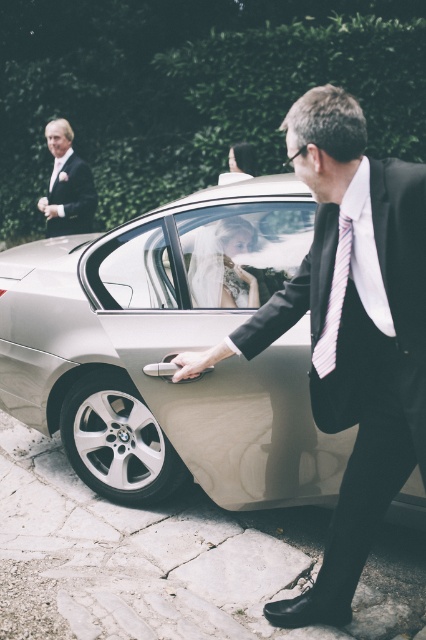
What is the object located at the point with coordinates (170,349) in the image?

The point at (170,349) marks the silver metallic car at center.

From the picture: You are a photographer at the wedding venue and need to capture a closeup shot of the matte black suit at center and the white striped tie at right. Based on their positions, which object is lower in the frame?

The matte black suit at center is located below the white striped tie at right, so the matte black suit at center is lower in the frame.

You are a photographer at the wedding event and need to capture a clear shot of both the matte black suit at center and the white striped tie at right. Since the camera can only focus on one subject at a time, which object should you prioritize focusing on to ensure it appears sharp?

The matte black suit at center is closer to the viewer than the white striped tie at right, so focusing on the matte black suit at center will ensure it appears sharp, and the white striped tie at right may still be in acceptable focus depending on the camera settings.